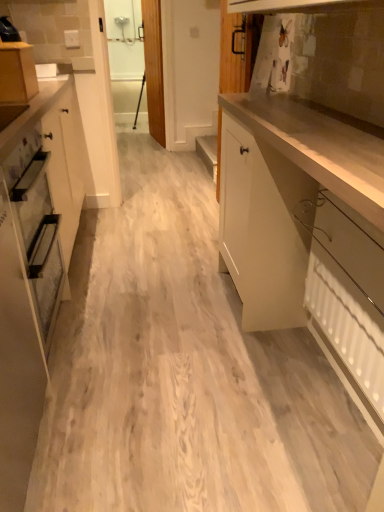
Where is `vacant region below matte wood cabinet at upper left, which is counted as the third cabinetry, starting from the right (from a real-world perspective)`? This screenshot has width=384, height=512. vacant region below matte wood cabinet at upper left, which is counted as the third cabinetry, starting from the right (from a real-world perspective) is located at coordinates [52, 268].